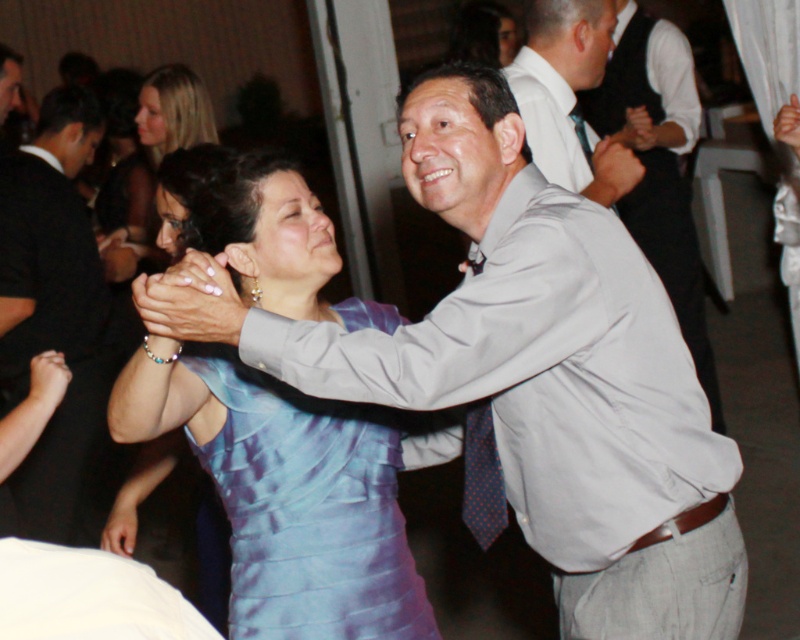
Does satin blue dress at center have a lesser height compared to light gray shirt at upper right?

Correct, satin blue dress at center is not as tall as light gray shirt at upper right.

Can you confirm if satin blue dress at center is positioned to the right of light gray shirt at upper right?

Incorrect, satin blue dress at center is not on the right side of light gray shirt at upper right.

Does point (320, 554) come in front of point (662, 282)?

Yes, point (320, 554) is in front of point (662, 282).

Locate an element on the screen. This screenshot has height=640, width=800. satin blue dress at center is located at coordinates (312, 508).

Which is below, satin blue dress at center or gray fabric shirt at upper center?

satin blue dress at center

Can you confirm if satin blue dress at center is taller than gray fabric shirt at upper center?

Correct, satin blue dress at center is much taller as gray fabric shirt at upper center.

Does point (282, 532) come in front of point (546, 170)?

Yes, point (282, 532) is closer to viewer.

This screenshot has height=640, width=800. Find the location of `satin blue dress at center`. satin blue dress at center is located at coordinates (312, 508).

Who is positioned more to the left, matte gray shirt at center or matte black suit at left?

matte black suit at left is more to the left.

Find the location of a particular element. This screenshot has height=640, width=800. matte gray shirt at center is located at coordinates (532, 372).

Looking at this image, who is more forward, (494, 100) or (38, 499)?

A: Point (494, 100) is in front.

At what (x,y) coordinates should I click in order to perform the action: click on matte gray shirt at center. Please return your answer as a coordinate pair (x, y). Looking at the image, I should click on (532, 372).